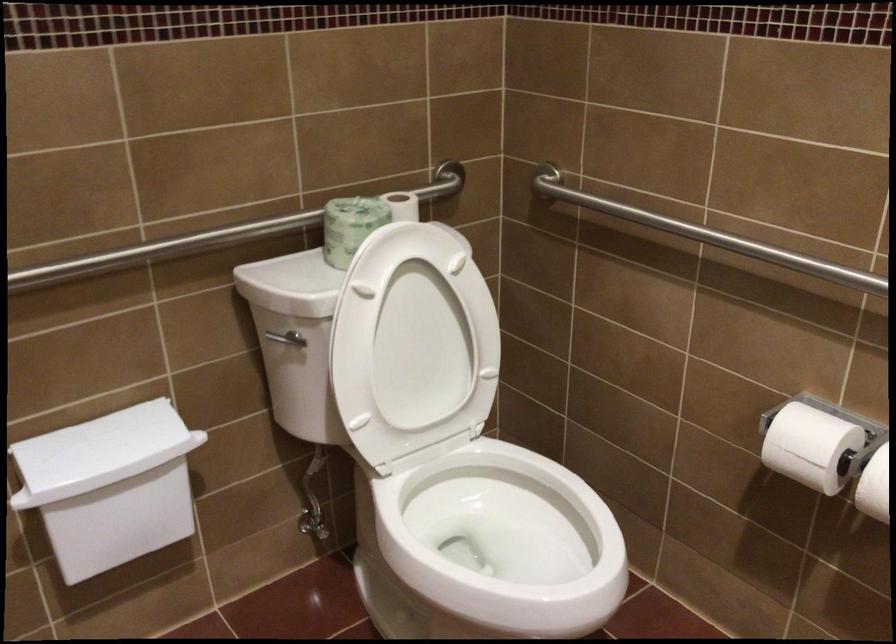
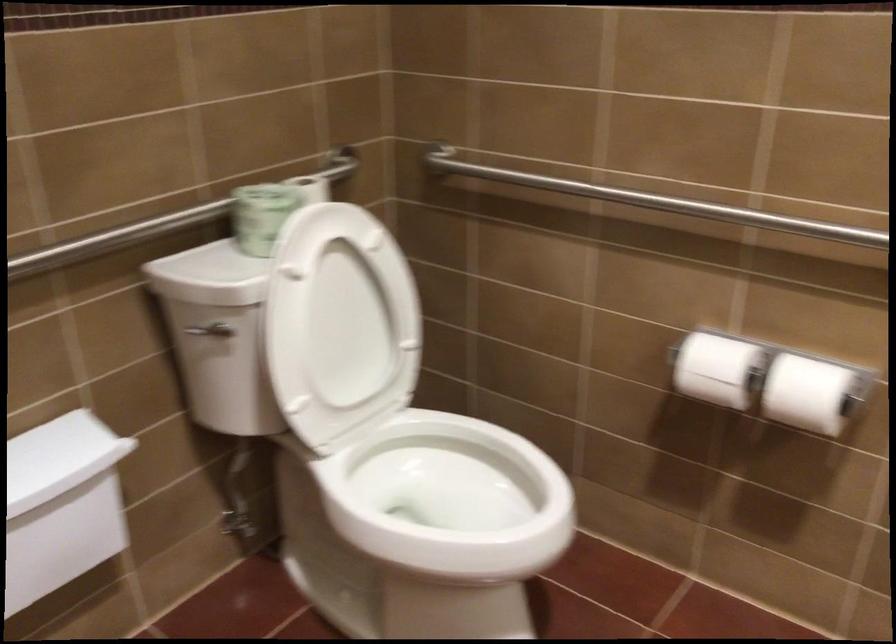
Question: Which direction would the cameraman need to move to produce the second image? Reply with the corresponding letter.

Choices:
 (A) Left
 (B) Right
 (C) Forward
 (D) Backward

Answer: (A)